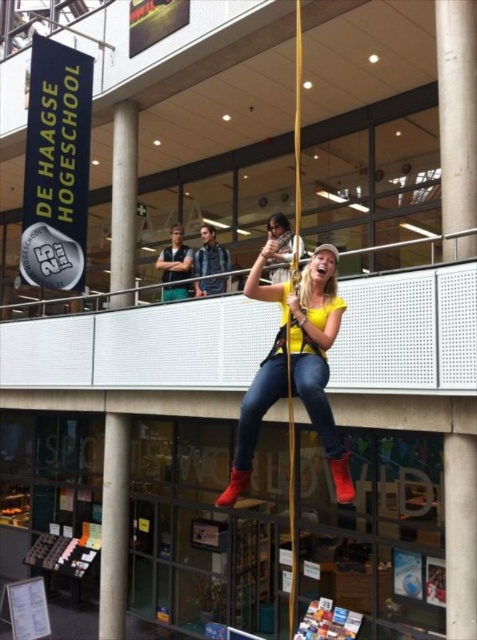
Question: Can you confirm if yellow matte/yellowish-green fabric at center is positioned above denim jacket at center?

Choices:
 (A) yes
 (B) no

Answer: (B)

Question: Which point is closer to the camera?

Choices:
 (A) denim jacket at center
 (B) yellow matte/yellowish-green fabric at center
 (C) matte blue jeans at center

Answer: (B)

Question: Is yellow matte/yellowish-green fabric at center smaller than denim jacket at center?

Choices:
 (A) yes
 (B) no

Answer: (B)

Question: Considering the real-world distances, which object is farthest from the matte blue jeans at center?

Choices:
 (A) yellow matte/yellowish-green fabric at center
 (B) denim jacket at center

Answer: (A)

Question: Estimate the real-world distances between objects in this image. Which object is closer to the matte blue jeans at center?

Choices:
 (A) denim jacket at center
 (B) yellow matte/yellowish-green fabric at center

Answer: (A)

Question: Does yellow matte/yellowish-green fabric at center have a larger size compared to matte blue jeans at center?

Choices:
 (A) no
 (B) yes

Answer: (B)